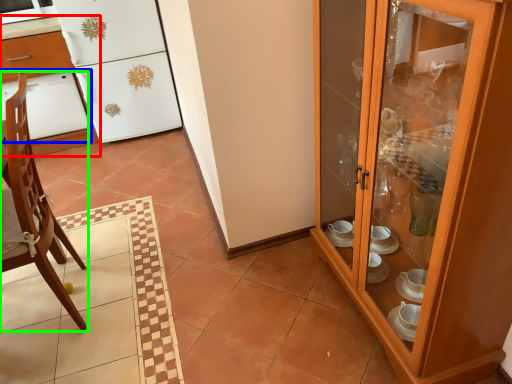
Question: Which is farther away from desk (highlighted by a red box)? oven (highlighted by a blue box) or chair (highlighted by a green box)?

Choices:
 (A) oven
 (B) chair

Answer: (B)